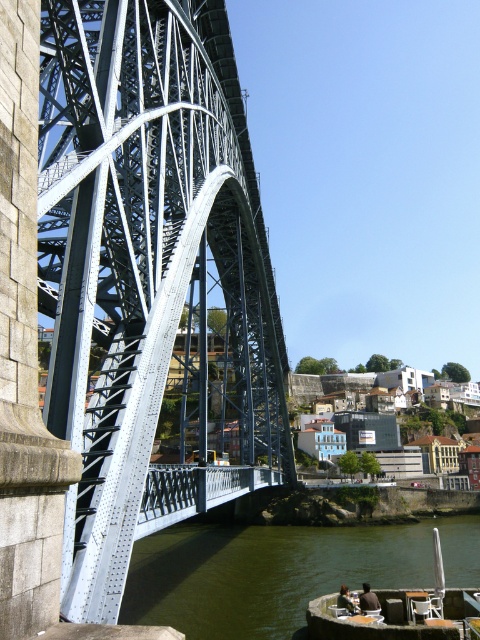
You are standing on the Dom Lu? I Bridge and looking at two points marked in the image. The first point is at coordinates point (271, 396) and the second is at point (350, 568). Which point is closer to your current position?

Point (271, 396) is further to the camera than point (350, 568). Therefore, point (350, 568) is closer to your current position.

Based on the photo, you are standing on the riverside promenade and want to take a photo of the metallic steel arch bridge at left and the greenish water at lower center. Which object should you frame first in your camera viewfinder to ensure both are in the shot?

You should frame the metallic steel arch bridge at left first since it is positioned to the left of the greenish water at lower center, ensuring both are included in the shot.